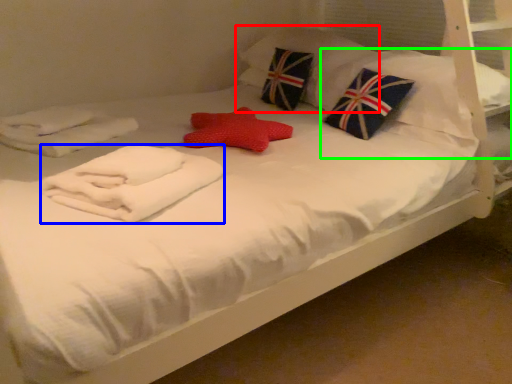
Question: Which object is positioned farthest from pillow (highlighted by a red box)? Select from material (highlighted by a blue box) and pillow (highlighted by a green box).

Choices:
 (A) material
 (B) pillow

Answer: (A)